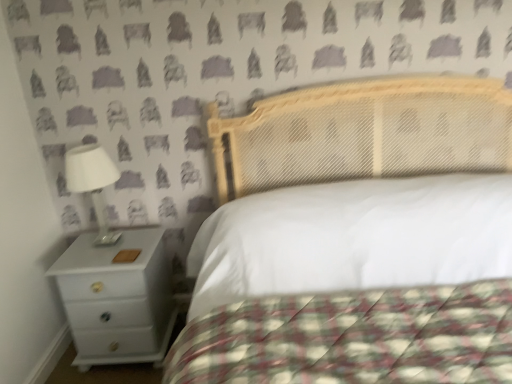
Locate an element on the screen. blank space above white glossy nightstand at lower left (from a real-world perspective) is located at coordinates (106, 246).